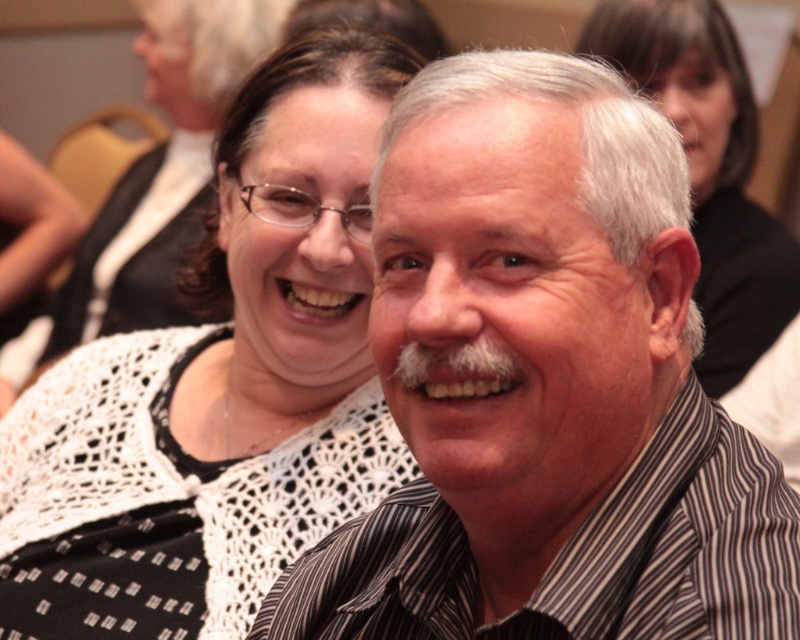
Does white crochet sweater at upper center appear on the left side of striped cotton shirt at center?

Yes, white crochet sweater at upper center is to the left of striped cotton shirt at center.

Does white crochet sweater at upper center have a greater height compared to striped cotton shirt at center?

Yes, white crochet sweater at upper center is taller than striped cotton shirt at center.

This screenshot has width=800, height=640. What do you see at coordinates (220, 385) in the screenshot? I see `white crochet sweater at upper center` at bounding box center [220, 385].

The height and width of the screenshot is (640, 800). I want to click on white crochet sweater at upper center, so click(220, 385).

Is point (729, 554) closer to camera compared to point (654, 1)?

Yes, point (729, 554) is closer to viewer.

Is striped cotton shirt at center further to the viewer compared to white lace top at upper center?

No, it is not.

Describe the element at coordinates (576, 556) in the screenshot. I see `striped cotton shirt at center` at that location.

This screenshot has width=800, height=640. I want to click on striped cotton shirt at center, so click(576, 556).

In the scene shown: Does striped shirt at center appear over white lace top at upper center?

No, striped shirt at center is not above white lace top at upper center.

Is striped shirt at center positioned in front of white lace top at upper center?

Yes, striped shirt at center is closer to the viewer.

Is point (636, 216) closer to viewer compared to point (682, 81)?

Yes, it is in front of point (682, 81).

Image resolution: width=800 pixels, height=640 pixels. What are the coordinates of `striped shirt at center` in the screenshot? It's located at (545, 385).